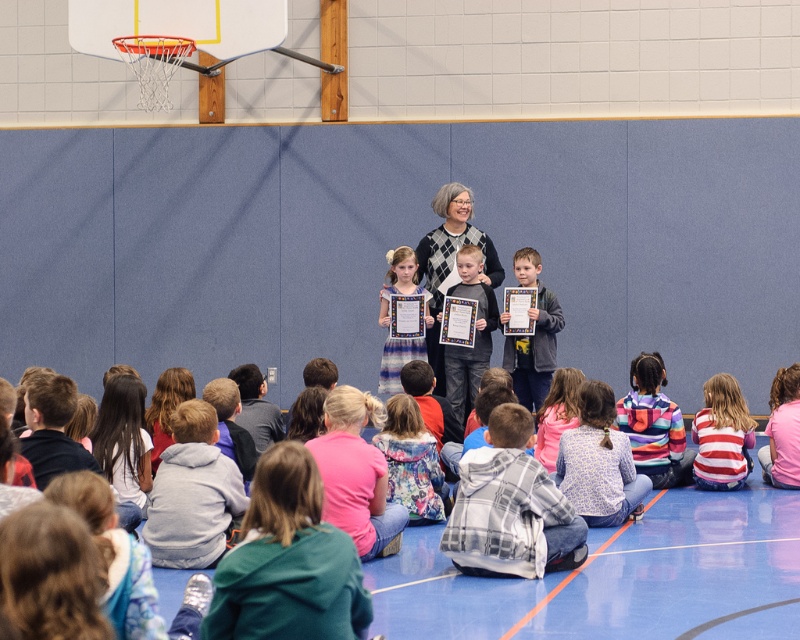
You are a photographer taking a picture of the certificate presentation. You need to ensure both the floral dress at center and the patterned fabric shirt at lower right are visible in the frame. Which one might you need to adjust your camera angle to include, and why?

The floral dress at center is much taller than the patterned fabric shirt at lower right, so you might need to adjust your camera angle to include the taller floral dress at center in the frame.